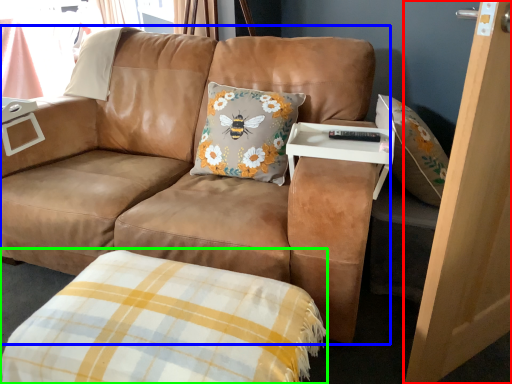
Question: Considering the real-world distances, which object is farthest from screen door (highlighted by a red box)? studio couch (highlighted by a blue box) or plaid (highlighted by a green box)?

Choices:
 (A) studio couch
 (B) plaid

Answer: (A)